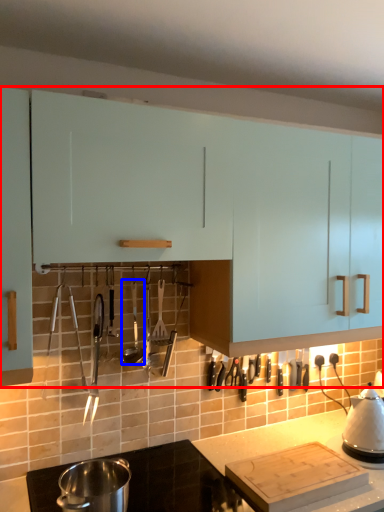
Question: Which object appears farthest to the camera in this image, cabinetry (highlighted by a red box) or silverware (highlighted by a blue box)?

Choices:
 (A) cabinetry
 (B) silverware

Answer: (B)